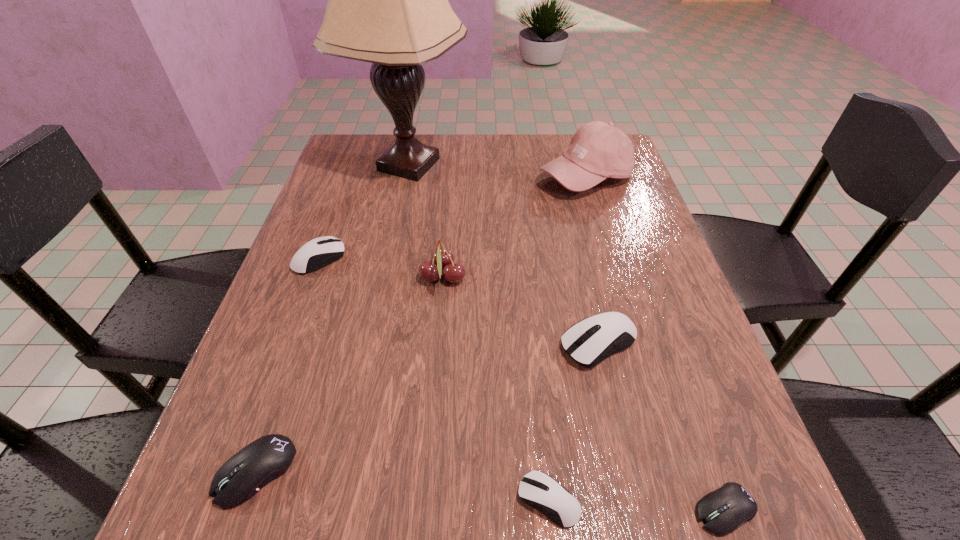
This screenshot has height=540, width=960. I want to click on object present at the near right corner, so click(723, 510).

This screenshot has width=960, height=540. I want to click on vacant space at the far edge of the desktop, so click(497, 134).

Where is `vacant region at the left edge of the desktop`? vacant region at the left edge of the desktop is located at coordinates (298, 332).

This screenshot has height=540, width=960. What are the coordinates of `vacant space at the right edge of the desktop` in the screenshot? It's located at [x=674, y=286].

In the image, there is a desktop. Find the location of `free space at the far left corner`. free space at the far left corner is located at coordinates (343, 150).

This screenshot has width=960, height=540. I want to click on vacant space at the near left corner, so click(x=277, y=512).

Locate an element on the screen. free space between the bigger black computer equipment and the lamp is located at coordinates (332, 318).

Locate an element on the screen. The height and width of the screenshot is (540, 960). vacant point located between the second tallest object and the farthest computer equipment is located at coordinates (452, 218).

I want to click on free space between the left black computer equipment and the fourth object from right to left, so click(x=402, y=485).

Locate an element on the screen. Image resolution: width=960 pixels, height=540 pixels. free space between the beige lamp and the leftmost white mouse is located at coordinates (364, 212).